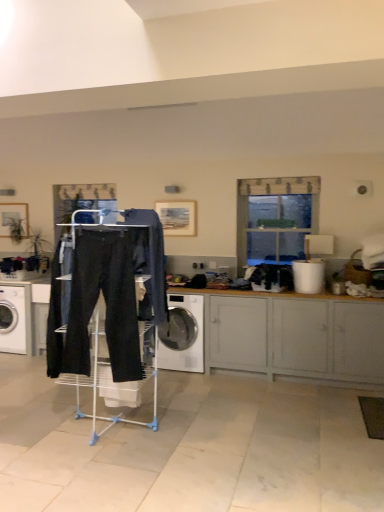
You are a GUI agent. You are given a task and a screenshot of the screen. Output one action in this format:
    pyautogui.click(x=<x>, y=<y>)
    Task: Click on the free point below black cotton sweat pants at center (from a real-world perspective)
    The height and width of the screenshot is (512, 384).
    Given the screenshot: What is the action you would take?
    pyautogui.click(x=102, y=441)